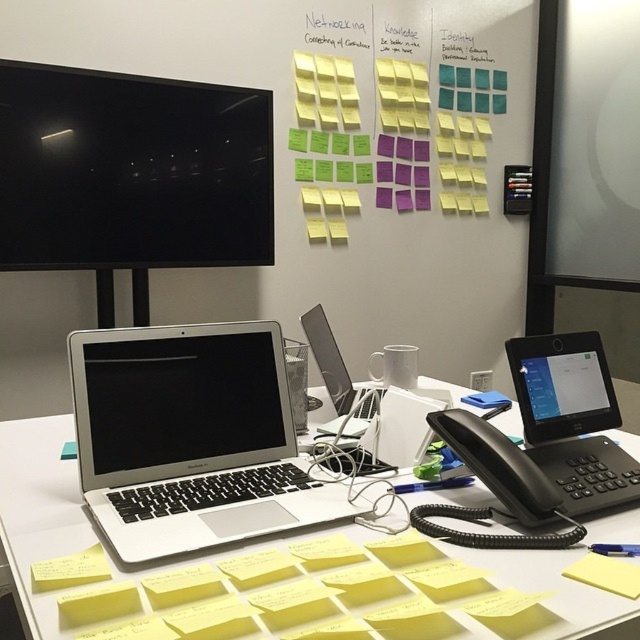
Between black glossy monitor at upper left and yellow paper at lower right, which one is positioned higher?

black glossy monitor at upper left is higher up.

Who is shorter, black glossy monitor at upper left or yellow paper at lower right?

yellow paper at lower right is shorter.

Between point (180, 236) and point (586, 573), which one is positioned in front?

Point (586, 573) is in front.

Where is `black glossy monitor at upper left`? Image resolution: width=640 pixels, height=640 pixels. black glossy monitor at upper left is located at coordinates (131, 170).

Is silver metallic laptop at center thinner than yellow paper at lower left?

In fact, silver metallic laptop at center might be wider than yellow paper at lower left.

Does point (225, 406) come behind point (88, 570)?

Yes, it is.

This screenshot has width=640, height=640. In order to click on silver metallic laptop at center in this screenshot , I will do `click(192, 438)`.

Is black glossy monitor at upper left taller than silver metallic laptop at lower left?

Yes, black glossy monitor at upper left is taller than silver metallic laptop at lower left.

Who is lower down, black glossy monitor at upper left or silver metallic laptop at lower left?

Positioned lower is silver metallic laptop at lower left.

Image resolution: width=640 pixels, height=640 pixels. Find the location of `black glossy monitor at upper left`. black glossy monitor at upper left is located at coordinates (131, 170).